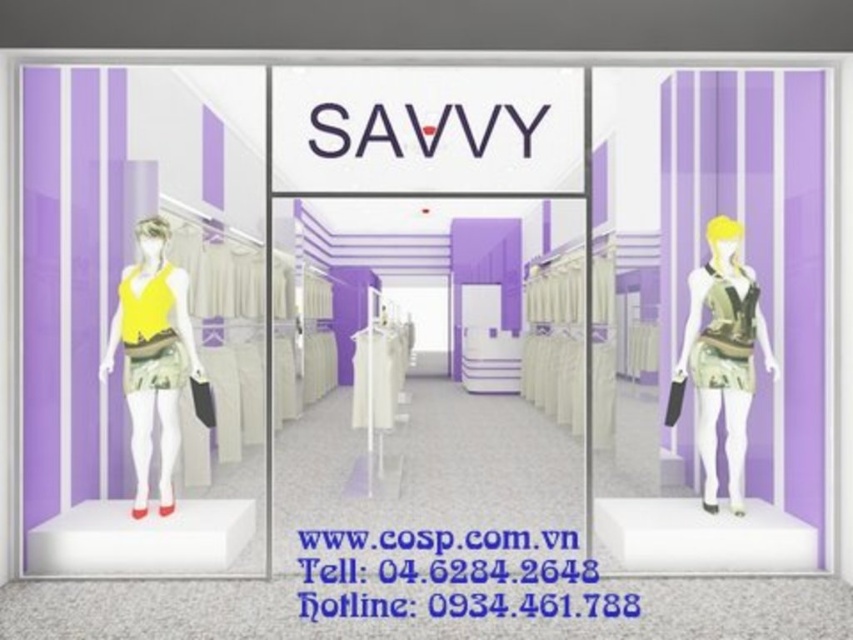
What do you see at coordinates (135, 328) in the screenshot? I see `matte yellow dress at left` at bounding box center [135, 328].

Identify the location of matte yellow dress at left. (135, 328).

Does matte yellow dress at left have a greater height compared to matte yellow fabric dress at left?

Yes.

Is matte yellow dress at left below matte yellow fabric dress at left?

Actually, matte yellow dress at left is above matte yellow fabric dress at left.

Between point (135, 212) and point (137, 515), which one is positioned behind?

Positioned behind is point (135, 212).

Find the location of a particular element. Image resolution: width=853 pixels, height=640 pixels. matte yellow dress at left is located at coordinates (135, 328).

Who is higher up, matte yellow dress at left or matte purple mannequin at right?

matte yellow dress at left is higher up.

Between matte yellow dress at left and matte purple mannequin at right, which one has less height?

matte purple mannequin at right is shorter.

Who is more forward, (190, 307) or (799, 499)?

Point (799, 499) is in front.

The width and height of the screenshot is (853, 640). I want to click on matte yellow dress at left, so [135, 328].